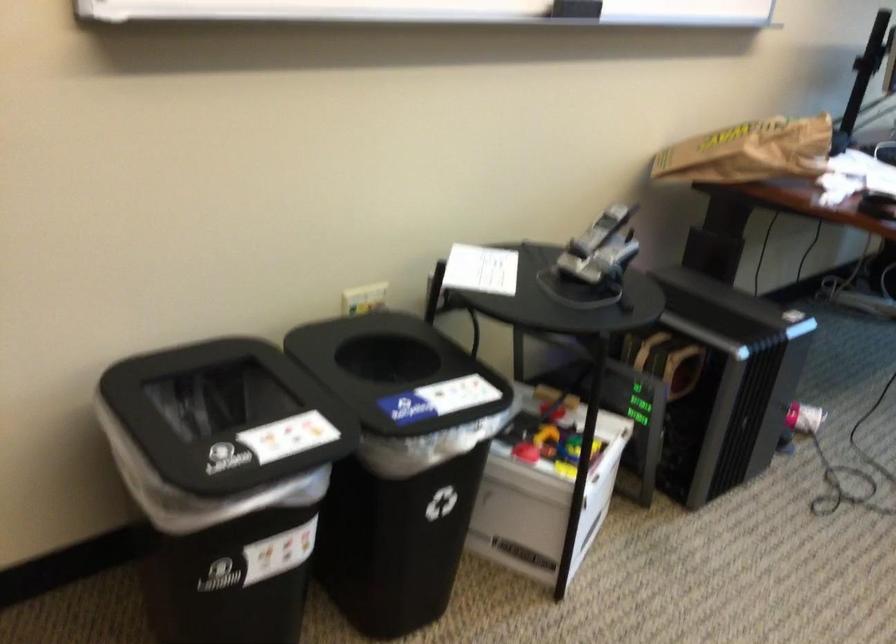
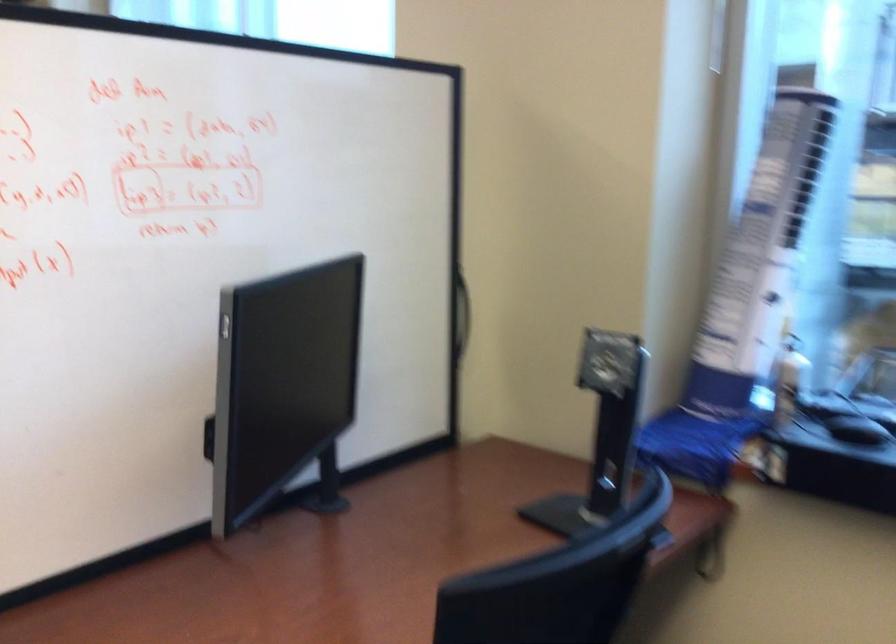
Question: In a continuous first-person perspective shot, in which direction is the camera moving?

Choices:
 (A) Left
 (B) Right
 (C) Forward
 (D) Backward

Answer: (B)